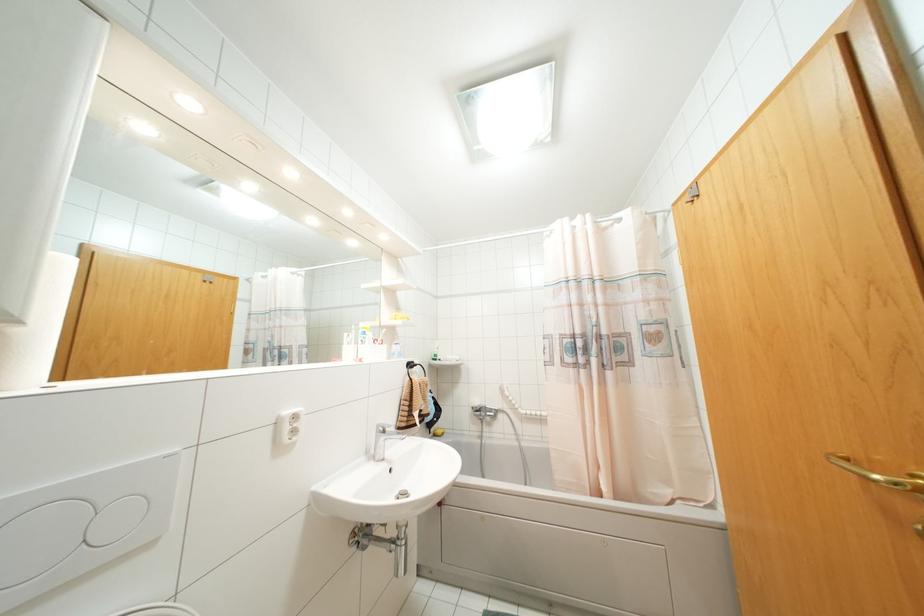
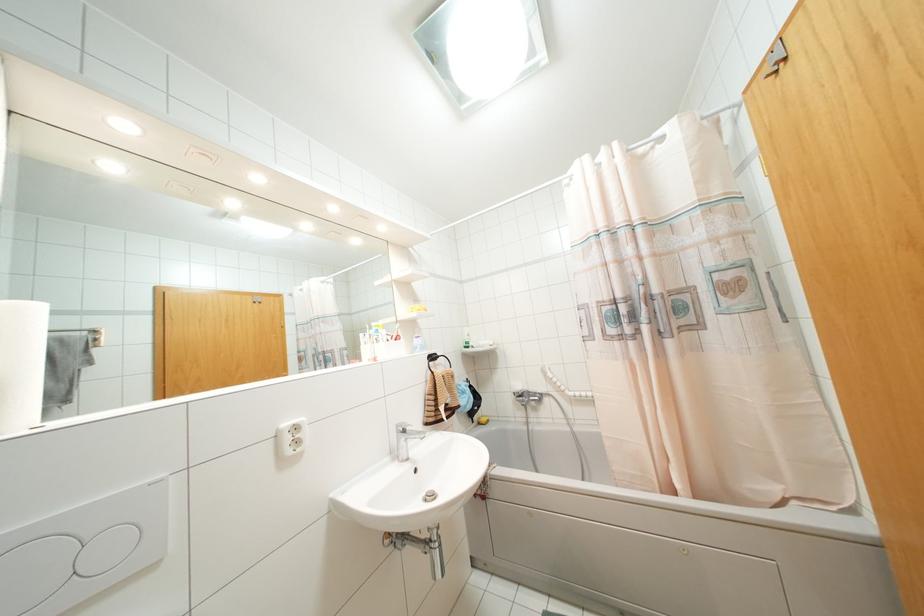
Locate, in the second image, the point that corresponds to (x=434, y=435) in the first image.

(479, 423)